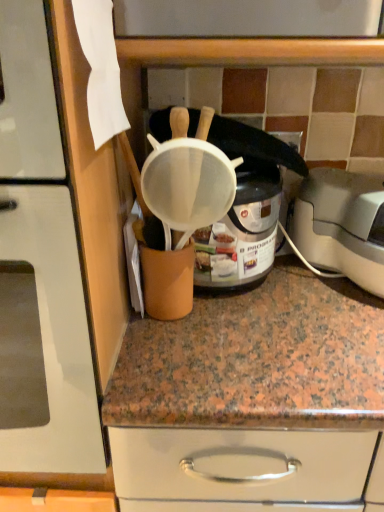
Question: Is point (49, 461) positioned closer to the camera than point (238, 273)?

Choices:
 (A) farther
 (B) closer

Answer: (B)

Question: Considering the positions of matte white strainer at upper center and white mesh strainer at center in the image, is matte white strainer at upper center wider or thinner than white mesh strainer at center?

Choices:
 (A) wide
 (B) thin

Answer: (A)

Question: Which object is positioned closest to the white mesh strainer at center?

Choices:
 (A) matte white strainer at upper center
 (B) white plastic toaster at right

Answer: (B)

Question: Which of these objects is positioned farthest from the white mesh strainer at center?

Choices:
 (A) matte white strainer at upper center
 (B) white plastic toaster at right

Answer: (A)